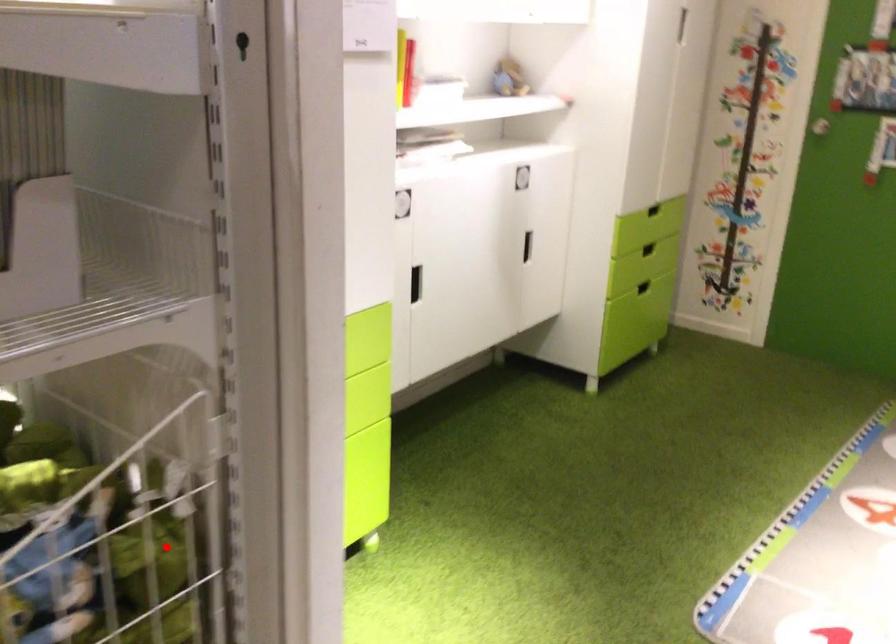
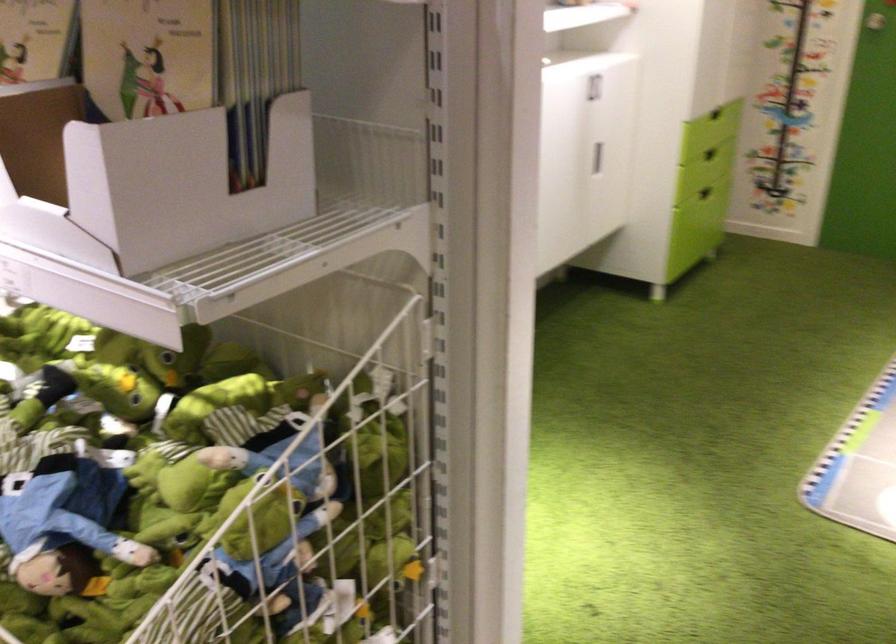
Question: I am providing you with two images of the same scene from different viewpoints. A red point is marked on the first image. Can you still see the location of the red point in image 2?

Choices:
 (A) Yes
 (B) No

Answer: (A)